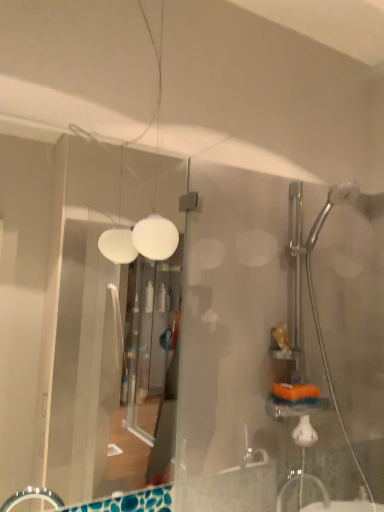
In order to face transparent glass door at left, should I rotate leftwards or rightwards?

Rotate left and turn 13.065 degrees.

The height and width of the screenshot is (512, 384). Describe the element at coordinates (110, 320) in the screenshot. I see `transparent glass door at left` at that location.

Locate an element on the screen. The height and width of the screenshot is (512, 384). transparent glass door at left is located at coordinates (110, 320).

What do you see at coordinates (155, 237) in the screenshot?
I see `white matte light fixture at upper center` at bounding box center [155, 237].

Measure the distance between white matte light fixture at upper center and camera.

They are 3.47 feet apart.

The height and width of the screenshot is (512, 384). Find the location of `white matte light fixture at upper center`. white matte light fixture at upper center is located at coordinates (155, 237).

Find the location of a particular element. This screenshot has width=384, height=512. transparent glass door at left is located at coordinates (110, 320).

Between white matte light fixture at upper center and transparent glass door at left, which one appears on the left side from the viewer's perspective?

From the viewer's perspective, transparent glass door at left appears more on the left side.

Who is more distant, white matte light fixture at upper center or transparent glass door at left?

white matte light fixture at upper center is further away from the camera.

Does point (172, 247) come in front of point (133, 421)?

Yes, it is.

From the picture: From the image's perspective, which one is positioned lower, white matte light fixture at upper center or transparent glass door at left?

transparent glass door at left is shown below in the image.

In the scene shown: From a real-world perspective, is white matte light fixture at upper center physically above transparent glass door at left?

Correct, in the physical world, white matte light fixture at upper center is higher than transparent glass door at left.

Considering the sizes of objects white matte light fixture at upper center and transparent glass door at left in the image provided, who is wider, white matte light fixture at upper center or transparent glass door at left?

Wider between the two is white matte light fixture at upper center.

Considering the sizes of objects white matte light fixture at upper center and transparent glass door at left in the image provided, who is shorter, white matte light fixture at upper center or transparent glass door at left?

Standing shorter between the two is white matte light fixture at upper center.

Can you confirm if white matte light fixture at upper center is smaller than transparent glass door at left?

Yes.

Is transparent glass door at left completely or partially inside white matte light fixture at upper center?

No, white matte light fixture at upper center does not contain transparent glass door at left.

Are white matte light fixture at upper center and transparent glass door at left beside each other?

There is a gap between white matte light fixture at upper center and transparent glass door at left.

Is white matte light fixture at upper center facing towards transparent glass door at left?

No, white matte light fixture at upper center is not turned towards transparent glass door at left.

At what (x,y) coordinates should I click in order to perform the action: click on glass door that appears in front of the white matte light fixture at upper center. Please return your answer as a coordinate pair (x, y). The width and height of the screenshot is (384, 512). Looking at the image, I should click on point(110,320).

Which object is positioned more to the right, transparent glass door at left or white matte light fixture at upper center?

Positioned to the right is white matte light fixture at upper center.

Is transparent glass door at left closer to camera compared to white matte light fixture at upper center?

Yes, it is.

Does point (68, 464) come farther from viewer compared to point (142, 8)?

Yes, point (68, 464) is behind point (142, 8).

From the image's perspective, is transparent glass door at left located above white matte light fixture at upper center?

Incorrect, from the image's perspective, transparent glass door at left is lower than white matte light fixture at upper center.

From a real-world perspective, is transparent glass door at left located higher than white matte light fixture at upper center?

Actually, transparent glass door at left is physically below white matte light fixture at upper center in the real world.

Does transparent glass door at left have a greater width compared to white matte light fixture at upper center?

In fact, transparent glass door at left might be narrower than white matte light fixture at upper center.

Which of these two, transparent glass door at left or white matte light fixture at upper center, stands taller?

transparent glass door at left.

Is transparent glass door at left smaller than white matte light fixture at upper center?

No, transparent glass door at left is not smaller than white matte light fixture at upper center.

Would you say transparent glass door at left is outside white matte light fixture at upper center?

Yes, transparent glass door at left is outside of white matte light fixture at upper center.

Are transparent glass door at left and white matte light fixture at upper center far apart?

Yes, transparent glass door at left and white matte light fixture at upper center are located far from each other.

Does transparent glass door at left turn towards white matte light fixture at upper center?

Yes, transparent glass door at left is facing white matte light fixture at upper center.

What's the angular difference between transparent glass door at left and white matte light fixture at upper center's facing directions?

0.284 degrees.

Image resolution: width=384 pixels, height=512 pixels. Identify the location of light fixture located above the transparent glass door at left (from a real-world perspective). click(x=155, y=237).

Image resolution: width=384 pixels, height=512 pixels. I want to click on glass door that is in front of the white matte light fixture at upper center, so click(x=110, y=320).

Locate an element on the screen. Image resolution: width=384 pixels, height=512 pixels. light fixture lying behind the transparent glass door at left is located at coordinates (155, 237).